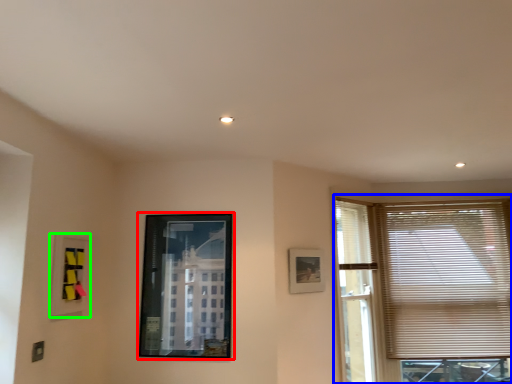
Question: Estimate the real-world distances between objects in this image. Which object is farther from picture frame (highlighted by a red box), window (highlighted by a blue box) or picture frame (highlighted by a green box)?

Choices:
 (A) window
 (B) picture frame

Answer: (A)